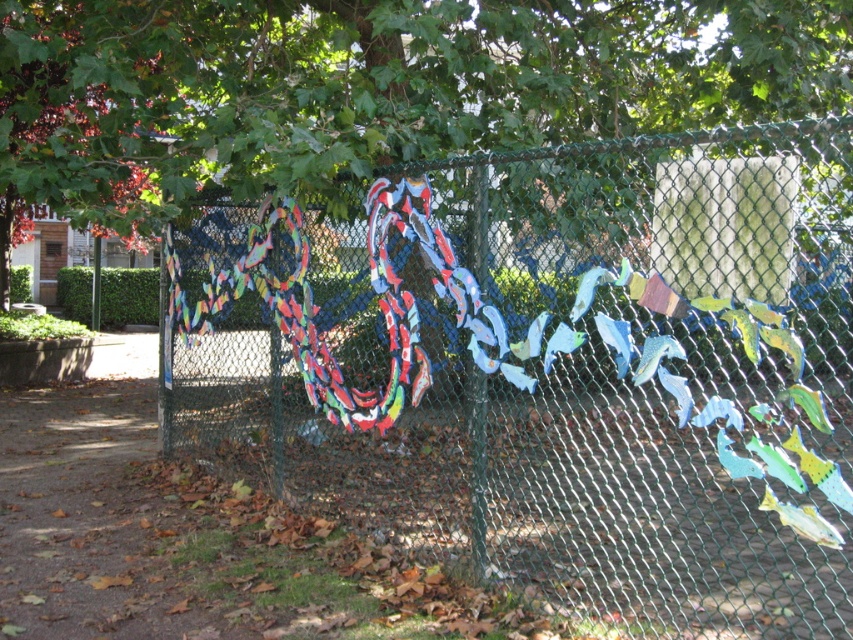
Question: Observing the image, what is the correct spatial positioning of metallic chain-link fence at center in reference to green leafy tree at upper center?

Choices:
 (A) below
 (B) above

Answer: (A)

Question: Where is metallic chain-link fence at center located in relation to green leafy tree at upper center in the image?

Choices:
 (A) left
 (B) right

Answer: (B)

Question: Is metallic chain-link fence at center thinner than green leafy tree at upper center?

Choices:
 (A) no
 (B) yes

Answer: (A)

Question: Among these objects, which one is nearest to the camera?

Choices:
 (A) metallic chain-link fence at center
 (B) green leafy tree at upper center

Answer: (A)